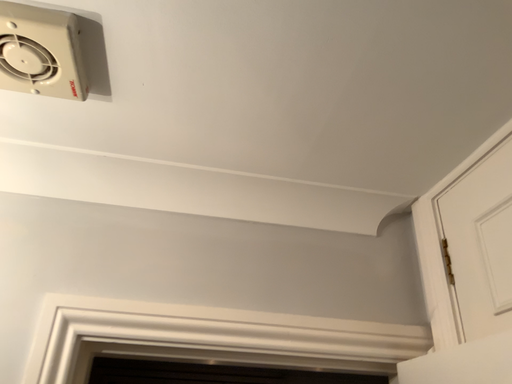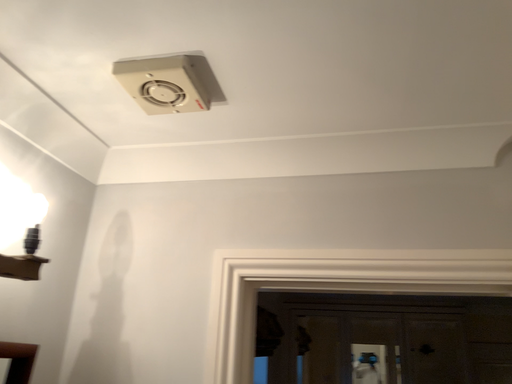
Question: How did the camera likely rotate when shooting the video?

Choices:
 (A) rotated right
 (B) rotated left

Answer: (B)